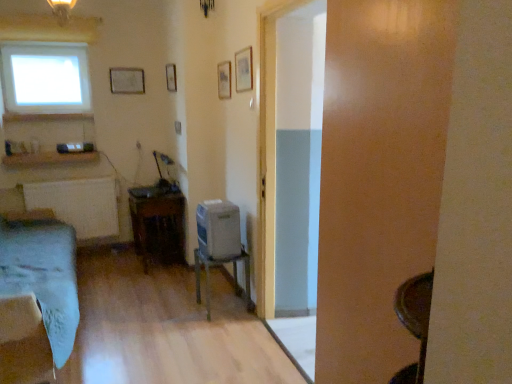
Question: Which direction should I rotate to look at matte wooden picture frame at upper center, positioned as the third picture frame in left-to-right order?

Choices:
 (A) left
 (B) right

Answer: (A)

Question: From a real-world perspective, is matte white picture frame at upper center, acting as the 4th picture frame starting from the right, located higher than transparent glass window at upper left?

Choices:
 (A) no
 (B) yes

Answer: (A)

Question: Is matte white picture frame at upper center, positioned as the first picture frame in back-to-front order, not near transparent glass window at upper left?

Choices:
 (A) yes
 (B) no

Answer: (B)

Question: Is matte white picture frame at upper center, acting as the 4th picture frame starting from the right, shorter than transparent glass window at upper left?

Choices:
 (A) yes
 (B) no

Answer: (A)

Question: From the image's perspective, is matte white picture frame at upper center, positioned as the first picture frame in back-to-front order, located above transparent glass window at upper left?

Choices:
 (A) no
 (B) yes

Answer: (A)

Question: Is matte white picture frame at upper center, which ranks as the fourth picture frame in front-to-back order, aimed at transparent glass window at upper left?

Choices:
 (A) no
 (B) yes

Answer: (A)

Question: Considering the relative sizes of matte white picture frame at upper center, positioned as the first picture frame in back-to-front order, and transparent glass window at upper left in the image provided, is matte white picture frame at upper center, positioned as the first picture frame in back-to-front order, smaller than transparent glass window at upper left?

Choices:
 (A) no
 (B) yes

Answer: (B)

Question: Can you see matte wooden picture frame at upper center, positioned as the third picture frame in left-to-right order, touching wooden picture frame at upper center, marked as the 4th picture frame in a back-to-front arrangement?

Choices:
 (A) no
 (B) yes

Answer: (A)

Question: Does matte wooden picture frame at upper center, marked as the second picture frame in a right-to-left arrangement, come in front of wooden picture frame at upper center, marked as the 4th picture frame in a back-to-front arrangement?

Choices:
 (A) yes
 (B) no

Answer: (B)

Question: From the image's perspective, would you say matte wooden picture frame at upper center, which appears as the 2th picture frame when viewed from the front, is positioned over wooden picture frame at upper center, the first picture frame when ordered from front to back?

Choices:
 (A) no
 (B) yes

Answer: (B)

Question: Can you confirm if matte wooden picture frame at upper center, which appears as the 2th picture frame when viewed from the front, is positioned to the right of wooden picture frame at upper center, the first picture frame when ordered from front to back?

Choices:
 (A) no
 (B) yes

Answer: (A)

Question: Could wooden picture frame at upper center, marked as the 4th picture frame in a back-to-front arrangement, be considered to be inside matte wooden picture frame at upper center, which appears as the third picture frame when viewed from the back?

Choices:
 (A) no
 (B) yes

Answer: (A)

Question: From a real-world perspective, is matte wooden picture frame at upper center, which appears as the 2th picture frame when viewed from the front, positioned under wooden picture frame at upper center, which is the 4th picture frame from left to right, based on gravity?

Choices:
 (A) yes
 (B) no

Answer: (A)

Question: From a real-world perspective, is wooden table at center, which ranks as the second table in right-to-left order, positioned over wooden picture frame at upper center, the 3th picture frame in the right-to-left sequence, based on gravity?

Choices:
 (A) no
 (B) yes

Answer: (A)